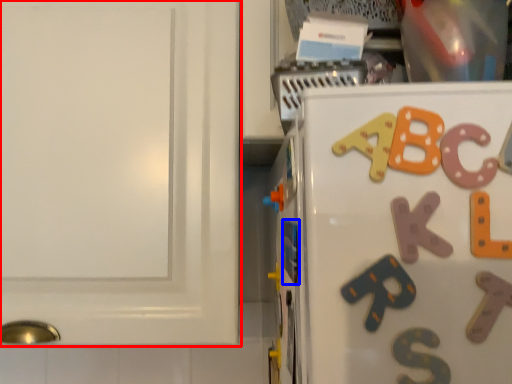
Question: Which of the following is the farthest to the observer, cabinetry (highlighted by a red box) or magnet (highlighted by a blue box)?

Choices:
 (A) cabinetry
 (B) magnet

Answer: (A)